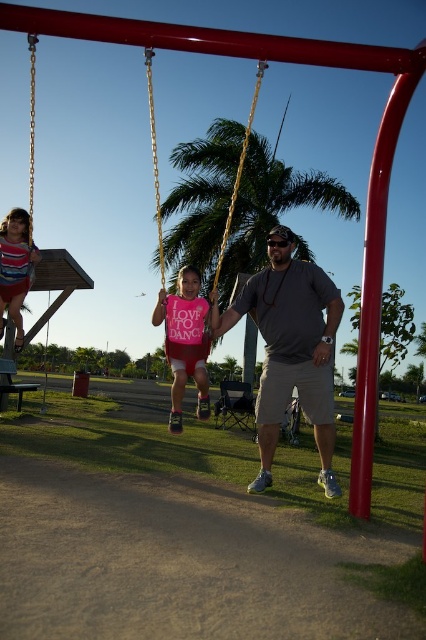
Question: Does pink matte shirt at center appear under gold chain swing at center?

Choices:
 (A) no
 (B) yes

Answer: (B)

Question: Where is pink matte shirt at center located in relation to striped fabric dress at left in the image?

Choices:
 (A) left
 (B) right

Answer: (B)

Question: Which of the following is the farthest from the observer?

Choices:
 (A) striped fabric dress at left
 (B) gray cotton shirt at center
 (C) green leafy palm tree at center
 (D) pink matte shirt at center

Answer: (C)

Question: Can you confirm if green leafy palm tree at center is positioned to the right of gold chain swing at center?

Choices:
 (A) yes
 (B) no

Answer: (A)

Question: Among these objects, which one is nearest to the camera?

Choices:
 (A) gold chain swing at center
 (B) gray cotton shirt at center
 (C) green leafy palm tree at center

Answer: (A)

Question: Which object is the farthest from the gold chain swing at center?

Choices:
 (A) green leafy palm tree at center
 (B) striped fabric dress at left
 (C) pink matte shirt at center
 (D) gray cotton shirt at center

Answer: (C)